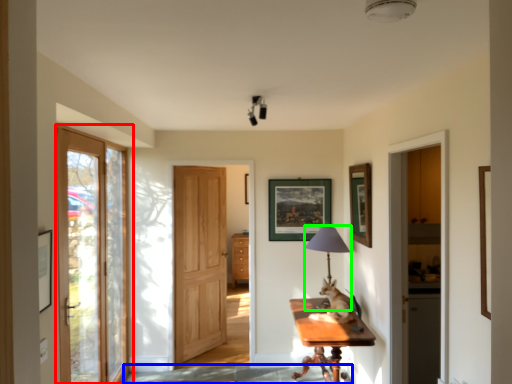
Question: Which is nearer to the door (highlighted by a red box)? path (highlighted by a blue box) or table lamp (highlighted by a green box).

Choices:
 (A) path
 (B) table lamp

Answer: (A)